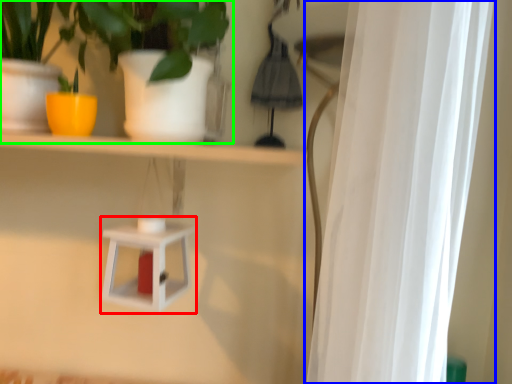
Question: Which is farther away from shelf (highlighted by a red box)? curtain (highlighted by a blue box) or houseplant (highlighted by a green box)?

Choices:
 (A) curtain
 (B) houseplant

Answer: (A)